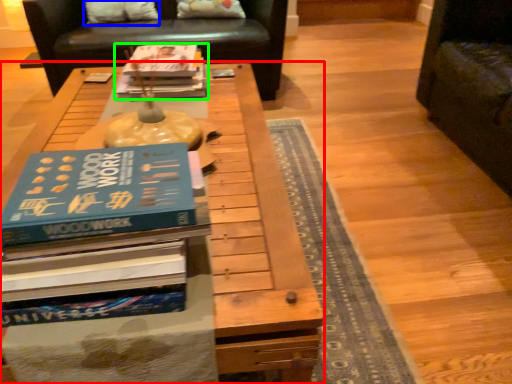
Question: Estimate the real-world distances between objects in this image. Which object is closer to table (highlighted by a red box), pillow (highlighted by a blue box) or book (highlighted by a green box)?

Choices:
 (A) pillow
 (B) book

Answer: (B)